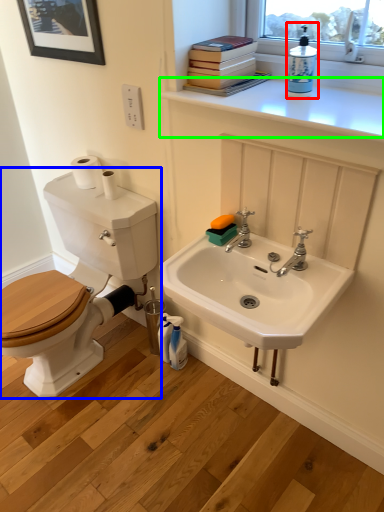
Question: Which object is the farthest from cleaning product (highlighted by a red box)? Choose among these: toilet (highlighted by a blue box) or counter top (highlighted by a green box).

Choices:
 (A) toilet
 (B) counter top

Answer: (A)